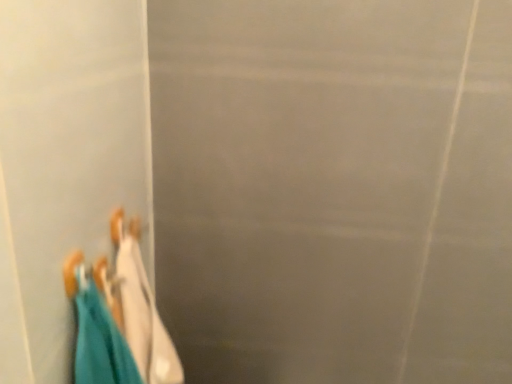
The height and width of the screenshot is (384, 512). Describe the element at coordinates (136, 306) in the screenshot. I see `white fabric at left` at that location.

This screenshot has width=512, height=384. Find the location of `white fabric at left`. white fabric at left is located at coordinates (136, 306).

Locate an element on the screen. This screenshot has width=512, height=384. white fabric at left is located at coordinates (136, 306).